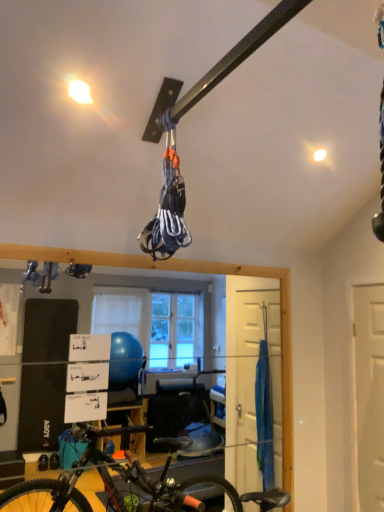
Question: Can you confirm if white matte door at right is bigger than black matte bicycle at lower left?

Choices:
 (A) yes
 (B) no

Answer: (B)

Question: From a real-world perspective, is white matte door at right positioned over black matte bicycle at lower left based on gravity?

Choices:
 (A) no
 (B) yes

Answer: (B)

Question: Is white matte door at right closer to the viewer compared to black matte bicycle at lower left?

Choices:
 (A) yes
 (B) no

Answer: (B)

Question: Is white matte door at right thinner than black matte bicycle at lower left?

Choices:
 (A) no
 (B) yes

Answer: (B)

Question: Is white matte door at right shorter than black matte bicycle at lower left?

Choices:
 (A) no
 (B) yes

Answer: (A)

Question: Can you confirm if white matte door at right is wider than black matte bicycle at lower left?

Choices:
 (A) yes
 (B) no

Answer: (B)

Question: Can you confirm if black matte bicycle at lower left is bigger than white matte door at right?

Choices:
 (A) no
 (B) yes

Answer: (B)

Question: From a real-world perspective, does black matte bicycle at lower left stand above white matte door at right?

Choices:
 (A) yes
 (B) no

Answer: (B)

Question: Are black matte bicycle at lower left and white matte door at right making contact?

Choices:
 (A) yes
 (B) no

Answer: (B)

Question: Can you confirm if black matte bicycle at lower left is positioned to the left of white matte door at right?

Choices:
 (A) yes
 (B) no

Answer: (A)

Question: Is black matte bicycle at lower left outside of white matte door at right?

Choices:
 (A) yes
 (B) no

Answer: (A)

Question: From the image's perspective, would you say black matte bicycle at lower left is positioned over white matte door at right?

Choices:
 (A) yes
 (B) no

Answer: (B)

Question: Considering the positions of white matte door at right and black matte bicycle at lower left in the image, is white matte door at right taller or shorter than black matte bicycle at lower left?

Choices:
 (A) tall
 (B) short

Answer: (A)